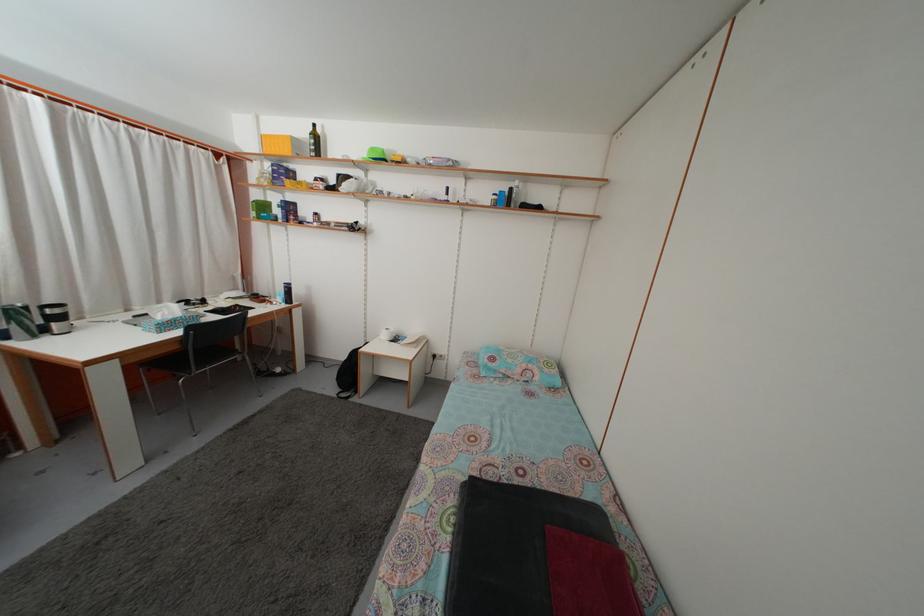
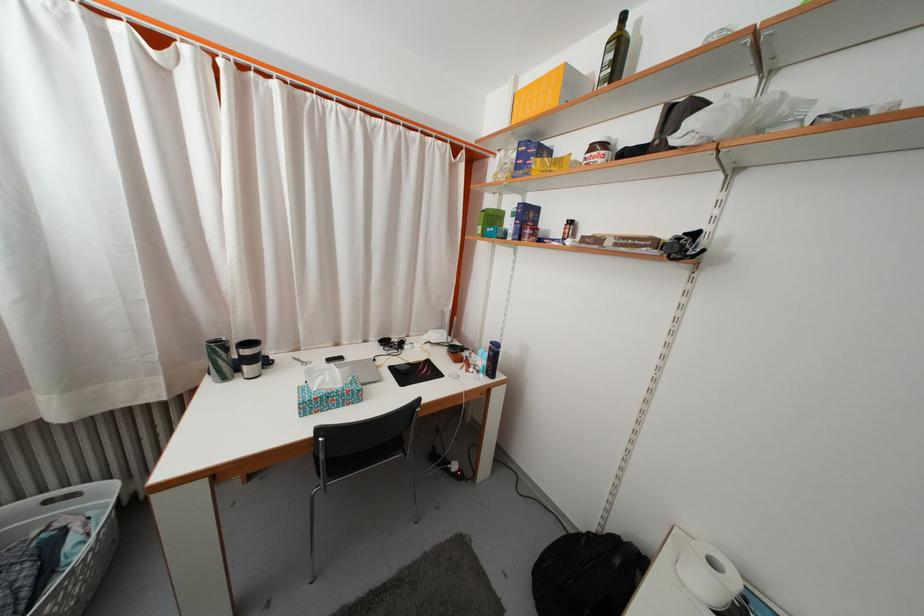
Find the pixel in the second image that matches point 270,214 in the first image.

(500, 225)